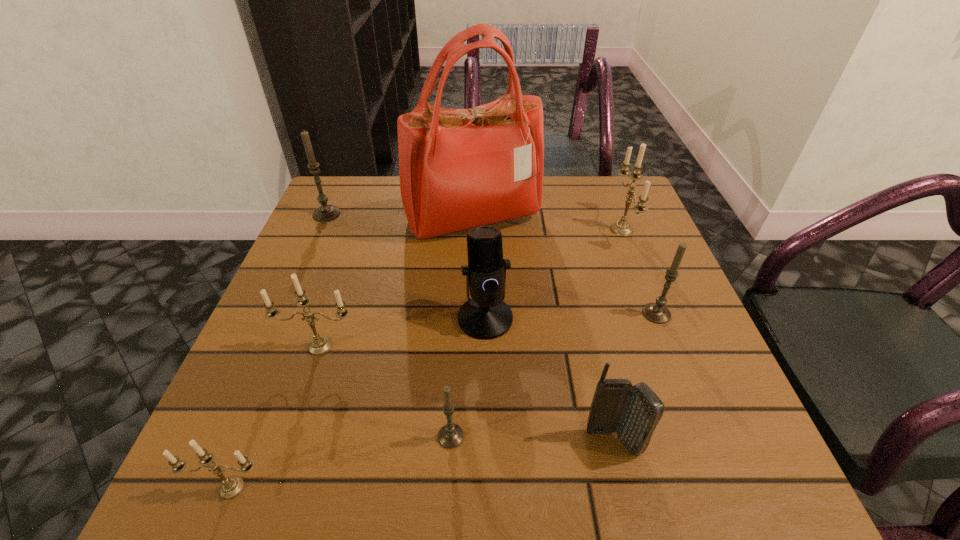
This screenshot has width=960, height=540. What are the coordinates of `vacant area situated 0.160m on the back of the second smallest gray candle` in the screenshot? It's located at (633, 253).

You are a GUI agent. You are given a task and a screenshot of the screen. Output one action in this format:
    pyautogui.click(x=<x>, y=<y>)
    Task: Click on the vacant area situated 0.340m on the right of the second biggest metallic candle
    Image resolution: width=960 pixels, height=540 pixels.
    Given the screenshot: What is the action you would take?
    pyautogui.click(x=542, y=346)

Where is `free location located on the left of the fifth farthest candle`? The width and height of the screenshot is (960, 540). free location located on the left of the fifth farthest candle is located at coordinates (393, 436).

Identify the location of blank space located 0.380m on the back of the smallest metallic candle. (309, 293).

You are a GUI agent. You are given a task and a screenshot of the screen. Output one action in this format:
    pyautogui.click(x=<x>, y=<y>)
    Task: Click on the handbag present at the far edge
    The height and width of the screenshot is (540, 960).
    Given the screenshot: What is the action you would take?
    pyautogui.click(x=459, y=168)

At what (x,y) coordinates should I click in order to perform the action: click on cellular telephone present at the near edge. Please return your answer as a coordinate pair (x, y). This screenshot has height=540, width=960. Looking at the image, I should click on (633, 412).

Locate an element on the screen. object that is positioned at the far left corner is located at coordinates (325, 212).

Where is `object present at the near left corner`? object present at the near left corner is located at coordinates (231, 487).

What are the coordinates of `object that is at the far right corner` in the screenshot? It's located at (621, 228).

In the image, there is a desktop. What are the coordinates of `free space at the far edge` in the screenshot? It's located at (556, 226).